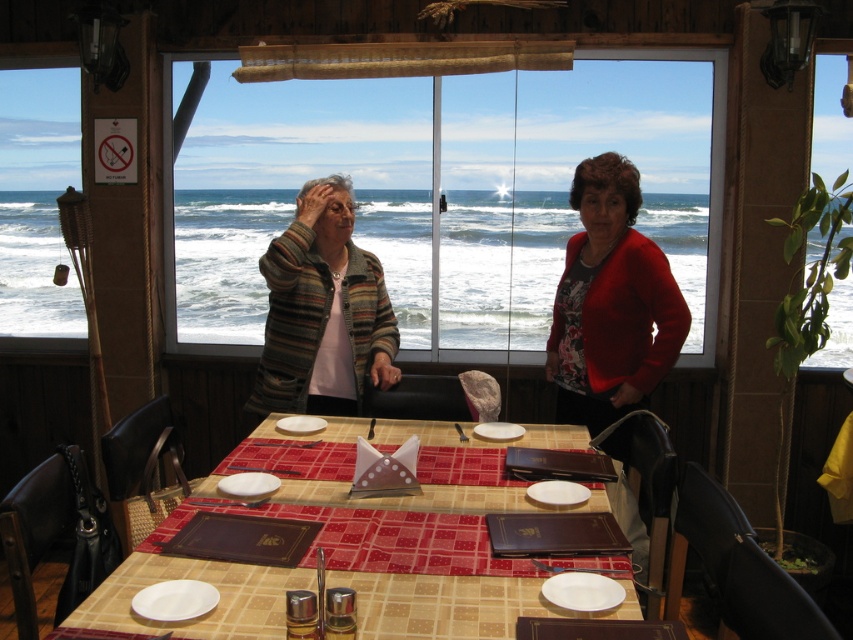
Who is lower down, plaid fabric table at center or red sweater at center?

plaid fabric table at center is lower down.

Which is more to the left, plaid fabric table at center or red sweater at center?

Positioned to the left is plaid fabric table at center.

Identify the location of plaid fabric table at center. This screenshot has width=853, height=640. (196, 579).

Between plaid fabric table at center and striped wool sweater at center, which one has more height?

With more height is striped wool sweater at center.

Who is more forward, (221, 563) or (299, 337)?

Positioned in front is point (221, 563).

You are a GUI agent. You are given a task and a screenshot of the screen. Output one action in this format:
    pyautogui.click(x=<x>, y=<y>)
    Task: Click on the plaid fabric table at center
    Image resolution: width=853 pixels, height=640 pixels.
    Given the screenshot: What is the action you would take?
    pyautogui.click(x=196, y=579)

Is point (566, 419) farther from viewer compared to point (616, 218)?

Yes, it is behind point (616, 218).

Find the location of a particular element. This screenshot has width=853, height=640. red sweater at center is located at coordinates (611, 301).

Identify the location of red sweater at center. This screenshot has width=853, height=640. pos(611,301).